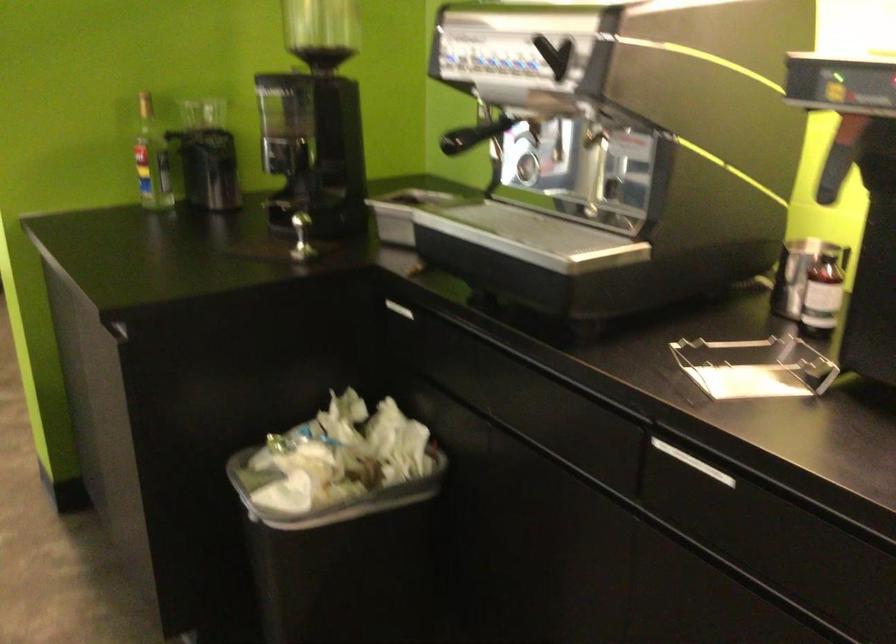
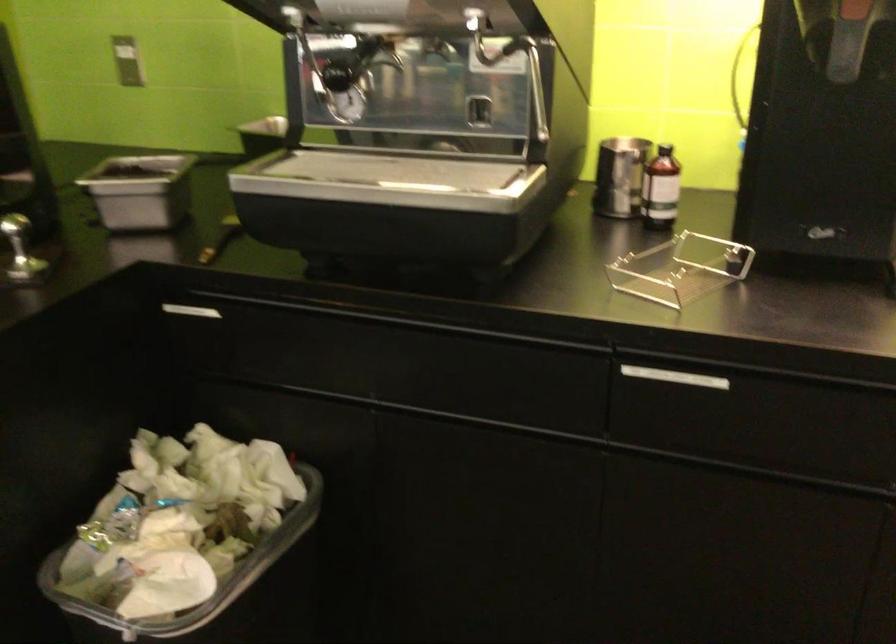
The point at (639, 152) is marked in the first image. Where is the corresponding point in the second image?

(513, 64)